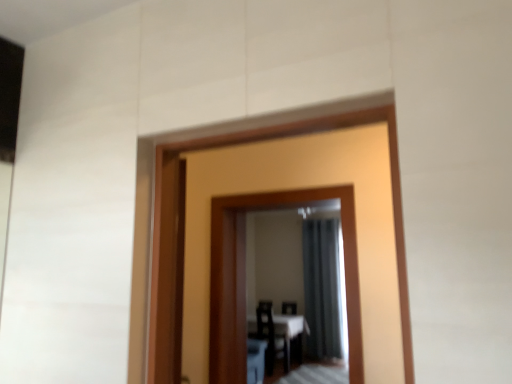
Question: Is black plastic chair at center spatially inside white glossy table at center, or outside of it?

Choices:
 (A) outside
 (B) inside

Answer: (A)

Question: In the image, is black plastic chair at center on the left side or the right side of white glossy table at center?

Choices:
 (A) left
 (B) right

Answer: (B)

Question: Based on their relative distances, which object is farther from the wooden mirror at center?

Choices:
 (A) black plastic chair at center
 (B) dark gray fabric curtain at center
 (C) white glossy table at center

Answer: (A)

Question: Based on their relative distances, which object is farther from the dark gray fabric curtain at center?

Choices:
 (A) black plastic chair at center
 (B) white glossy table at center
 (C) wooden mirror at center

Answer: (C)